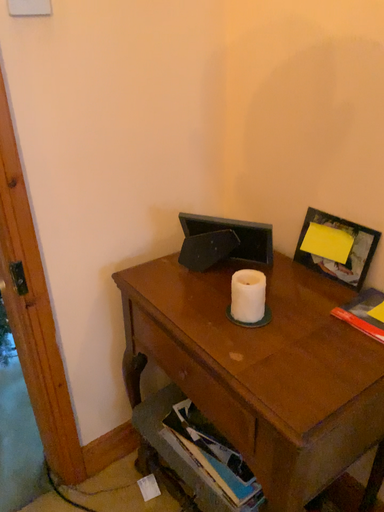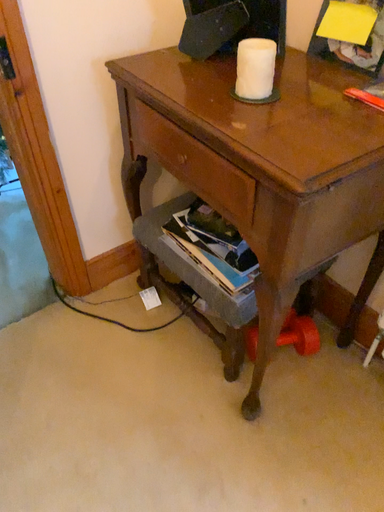
Question: How did the camera likely rotate when shooting the video?

Choices:
 (A) rotated upward
 (B) rotated downward

Answer: (B)